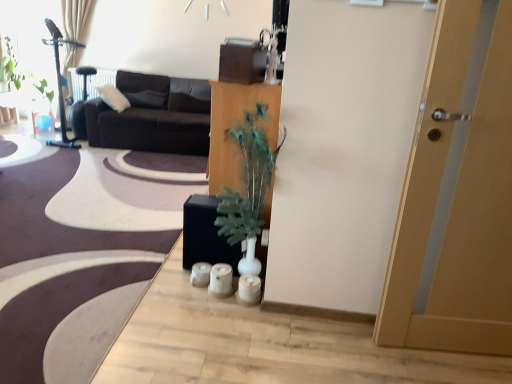
This screenshot has height=384, width=512. Identify the location of free spot below light brown wood door at right (from a real-world perspective). (454, 346).